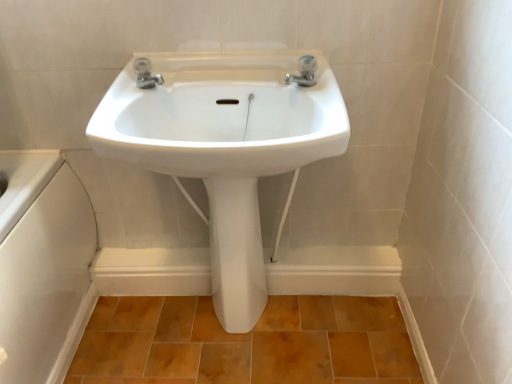
This screenshot has width=512, height=384. Describe the element at coordinates (304, 72) in the screenshot. I see `silver metallic tap at upper center, which is the second tap from left to right` at that location.

Image resolution: width=512 pixels, height=384 pixels. Describe the element at coordinates (236, 253) in the screenshot. I see `white glossy pedestal at center` at that location.

What do you see at coordinates (246, 342) in the screenshot?
I see `brown matte tile at lower center` at bounding box center [246, 342].

You are a GUI agent. You are given a task and a screenshot of the screen. Output one action in this format:
    pyautogui.click(x=<x>, y=<y>)
    Task: Click on the satin nickel faucet at upper center, the second tap from the right
    The height and width of the screenshot is (384, 512).
    Given the screenshot: What is the action you would take?
    pyautogui.click(x=146, y=74)

In order to click on silver metallic tap at upper center, which is the second tap from left to right in this screenshot , I will do `click(304, 72)`.

Where is `tap on the left of white glossy pedestal at center`? This screenshot has height=384, width=512. tap on the left of white glossy pedestal at center is located at coordinates (146, 74).

Which of these two, satin nickel faucet at upper center, the second tap from the right, or white glossy pedestal at center, is bigger?

Bigger between the two is white glossy pedestal at center.

Does point (158, 77) lie behind point (225, 263)?

No, (158, 77) is in front of (225, 263).

Can you confirm if satin nickel faucet at upper center, the second tap from the right, is positioned to the left of white glossy pedestal at center?

Yes, satin nickel faucet at upper center, the second tap from the right, is to the left of white glossy pedestal at center.

Is point (298, 81) positioned in front of point (207, 191)?

Yes.

Is silver metallic tap at upper center, the 1th tap from the right, surrounding white glossy pedestal at center?

Definitely not — white glossy pedestal at center is not inside silver metallic tap at upper center, the 1th tap from the right.

Between silver metallic tap at upper center, which is the second tap from left to right, and white glossy pedestal at center, which one has larger size?

white glossy pedestal at center.

From the image's perspective, who appears lower, silver metallic tap at upper center, which is the second tap from left to right, or white glossy pedestal at center?

white glossy pedestal at center, from the image's perspective.

From a real-world perspective, does brown matte tile at lower center stand above white glossy sink at center?

No, from a real-world perspective, brown matte tile at lower center is not on top of white glossy sink at center.

In the image, is brown matte tile at lower center positioned in front of or behind white glossy sink at center?

brown matte tile at lower center is positioned farther from the viewer than white glossy sink at center.

You are a GUI agent. You are given a task and a screenshot of the screen. Output one action in this format:
    pyautogui.click(x=<x>, y=<y>)
    Task: Click on the sink above the brown matte tile at lower center (from a real-world perspective)
    The image size is (512, 384).
    Given the screenshot: What is the action you would take?
    pyautogui.click(x=221, y=116)

Considering the sizes of objects white glossy pedestal at center and silver metallic tap at upper center, which is the second tap from left to right, in the image provided, who is taller, white glossy pedestal at center or silver metallic tap at upper center, which is the second tap from left to right,?

white glossy pedestal at center.

From the image's perspective, between white glossy pedestal at center and silver metallic tap at upper center, the 1th tap from the right, which one is located above?

silver metallic tap at upper center, the 1th tap from the right, appears higher in the image.

Who is smaller, white glossy pedestal at center or silver metallic tap at upper center, which is the second tap from left to right?

With smaller size is silver metallic tap at upper center, which is the second tap from left to right.

Is white glossy pedestal at center facing away from silver metallic tap at upper center, the 1th tap from the right?

No, white glossy pedestal at center's orientation is not away from silver metallic tap at upper center, the 1th tap from the right.

Is satin nickel faucet at upper center, the second tap from the right, not inside brown matte tile at lower center?

Absolutely, satin nickel faucet at upper center, the second tap from the right, is external to brown matte tile at lower center.

Is satin nickel faucet at upper center, the second tap from the right, placed right next to brown matte tile at lower center?

satin nickel faucet at upper center, the second tap from the right, and brown matte tile at lower center are not in contact.

Is satin nickel faucet at upper center, acting as the first tap starting from the left, aimed at brown matte tile at lower center?

No, satin nickel faucet at upper center, acting as the first tap starting from the left, is not turned towards brown matte tile at lower center.

From a real-world perspective, is satin nickel faucet at upper center, the second tap from the right, physically located above or below white glossy sink at center?

In terms of real-world spatial position, satin nickel faucet at upper center, the second tap from the right, is above white glossy sink at center.

From the picture: Would you say white glossy sink at center is part of satin nickel faucet at upper center, the second tap from the right,'s contents?

That's incorrect, white glossy sink at center is not inside satin nickel faucet at upper center, the second tap from the right.

Between satin nickel faucet at upper center, the second tap from the right, and white glossy sink at center, which one has smaller size?

satin nickel faucet at upper center, the second tap from the right.

What's the angular difference between satin nickel faucet at upper center, acting as the first tap starting from the left, and white glossy sink at center's facing directions?

The angular difference between satin nickel faucet at upper center, acting as the first tap starting from the left, and white glossy sink at center is 41.8 degrees.

From the image's perspective, is white glossy pedestal at center above or below satin nickel faucet at upper center, acting as the first tap starting from the left?

Based on their image positions, white glossy pedestal at center is located beneath satin nickel faucet at upper center, acting as the first tap starting from the left.

Is white glossy pedestal at center closer to camera compared to satin nickel faucet at upper center, acting as the first tap starting from the left?

No, it is not.

Are white glossy pedestal at center and satin nickel faucet at upper center, the second tap from the right, far apart?

No, white glossy pedestal at center is not far from satin nickel faucet at upper center, the second tap from the right.

Based on the photo, can you tell me how much white glossy pedestal at center and satin nickel faucet at upper center, the second tap from the right, differ in facing direction?

white glossy pedestal at center and satin nickel faucet at upper center, the second tap from the right, are facing 43.7 degrees away from each other.

At what (x,y) coordinates should I click in order to perform the action: click on bidet located behind the satin nickel faucet at upper center, acting as the first tap starting from the left. Please return your answer as a coordinate pair (x, y). Image resolution: width=512 pixels, height=384 pixels. Looking at the image, I should click on (236, 253).

The image size is (512, 384). In order to click on tap on the right of white glossy pedestal at center in this screenshot , I will do pos(304,72).

From the image, which object appears to be nearer to white glossy pedestal at center, silver metallic tap at upper center, the 1th tap from the right, or satin nickel faucet at upper center, acting as the first tap starting from the left?

Among the two, silver metallic tap at upper center, the 1th tap from the right, is located nearer to white glossy pedestal at center.

From the image, which object appears to be farther from silver metallic tap at upper center, the 1th tap from the right, white glossy sink at center or satin nickel faucet at upper center, acting as the first tap starting from the left?

satin nickel faucet at upper center, acting as the first tap starting from the left, lies further to silver metallic tap at upper center, the 1th tap from the right, than the other object.

Which object lies nearer to the anchor point white glossy sink at center, satin nickel faucet at upper center, the second tap from the right, or silver metallic tap at upper center, the 1th tap from the right?

The object closer to white glossy sink at center is satin nickel faucet at upper center, the second tap from the right.

Estimate the real-world distances between objects in this image. Which object is further from white glossy pedestal at center, silver metallic tap at upper center, which is the second tap from left to right, or brown matte tile at lower center?

The object further to white glossy pedestal at center is silver metallic tap at upper center, which is the second tap from left to right.

Based on their spatial positions, is satin nickel faucet at upper center, acting as the first tap starting from the left, or silver metallic tap at upper center, the 1th tap from the right, further from brown matte tile at lower center?

satin nickel faucet at upper center, acting as the first tap starting from the left.

Which object lies further to the anchor point white glossy pedestal at center, silver metallic tap at upper center, the 1th tap from the right, or white glossy sink at center?

silver metallic tap at upper center, the 1th tap from the right, lies further to white glossy pedestal at center than the other object.

When comparing their distances from brown matte tile at lower center, does white glossy pedestal at center or silver metallic tap at upper center, which is the second tap from left to right, seem further?

silver metallic tap at upper center, which is the second tap from left to right, lies further to brown matte tile at lower center than the other object.

Estimate the real-world distances between objects in this image. Which object is closer to satin nickel faucet at upper center, acting as the first tap starting from the left, white glossy sink at center or brown matte tile at lower center?

Among the two, white glossy sink at center is located nearer to satin nickel faucet at upper center, acting as the first tap starting from the left.

At what (x,y) coordinates should I click in order to perform the action: click on sink between satin nickel faucet at upper center, the second tap from the right, and brown matte tile at lower center in the up-down direction. Please return your answer as a coordinate pair (x, y). The height and width of the screenshot is (384, 512). Looking at the image, I should click on (221, 116).

At what (x,y) coordinates should I click in order to perform the action: click on bidet that lies between silver metallic tap at upper center, which is the second tap from left to right, and brown matte tile at lower center from top to bottom. Please return your answer as a coordinate pair (x, y). Looking at the image, I should click on (236, 253).

This screenshot has width=512, height=384. I want to click on sink situated between satin nickel faucet at upper center, the second tap from the right, and silver metallic tap at upper center, the 1th tap from the right, from left to right, so click(221, 116).

Identify the location of bidet between white glossy sink at center and brown matte tile at lower center in the up-down direction. Image resolution: width=512 pixels, height=384 pixels. (236, 253).